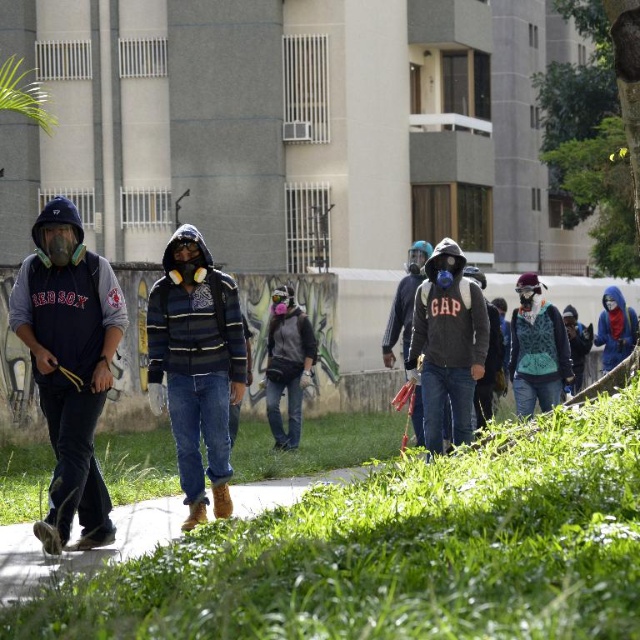
This screenshot has height=640, width=640. Describe the element at coordinates (536, 349) in the screenshot. I see `teal knitted vest at center` at that location.

Between teal knitted vest at center and blue matte jacket at right, which one is positioned lower?

teal knitted vest at center is below.

Where is `teal knitted vest at center`? teal knitted vest at center is located at coordinates (536, 349).

At what (x,y) coordinates should I click in order to perform the action: click on teal knitted vest at center. Please return your answer as a coordinate pair (x, y). This screenshot has height=640, width=640. Looking at the image, I should click on (536, 349).

Between gray matte jacket at center and blue matte jacket at right, which one has more height?

With more height is gray matte jacket at center.

Who is more distant from viewer, (276, 369) or (604, 352)?

The point (604, 352) is more distant.

The image size is (640, 640). Identify the location of gray matte jacket at center. point(288,364).

This screenshot has height=640, width=640. What are the coordinates of `gray matte jacket at center` in the screenshot? It's located at (288, 364).

This screenshot has height=640, width=640. What do you see at coordinates (536, 349) in the screenshot?
I see `teal knitted vest at center` at bounding box center [536, 349].

Consider the image. Does teal knitted vest at center lie in front of gray matte jacket at center?

That is True.

Is point (522, 390) farther from viewer compared to point (298, 339)?

No.

At what (x,y) coordinates should I click in order to perform the action: click on teal knitted vest at center. Please return your answer as a coordinate pair (x, y). The image size is (640, 640). Looking at the image, I should click on (536, 349).